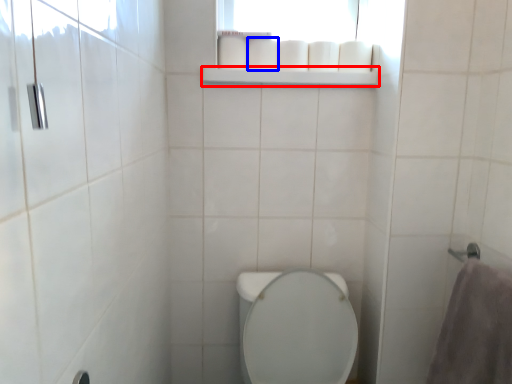
Question: Which of the following is the closest to the observer, balustrade (highlighted by a red box) or toilet paper (highlighted by a blue box)?

Choices:
 (A) balustrade
 (B) toilet paper

Answer: (A)